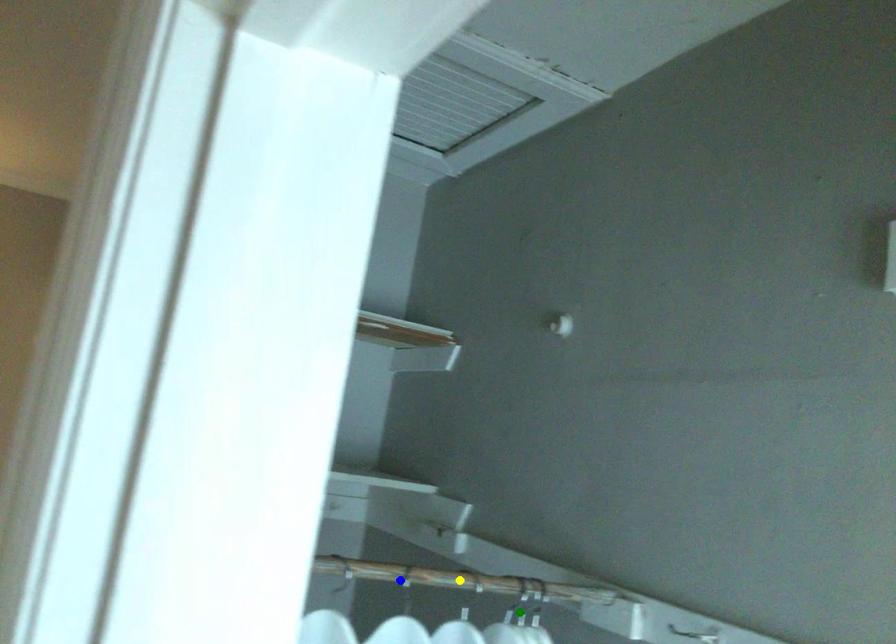
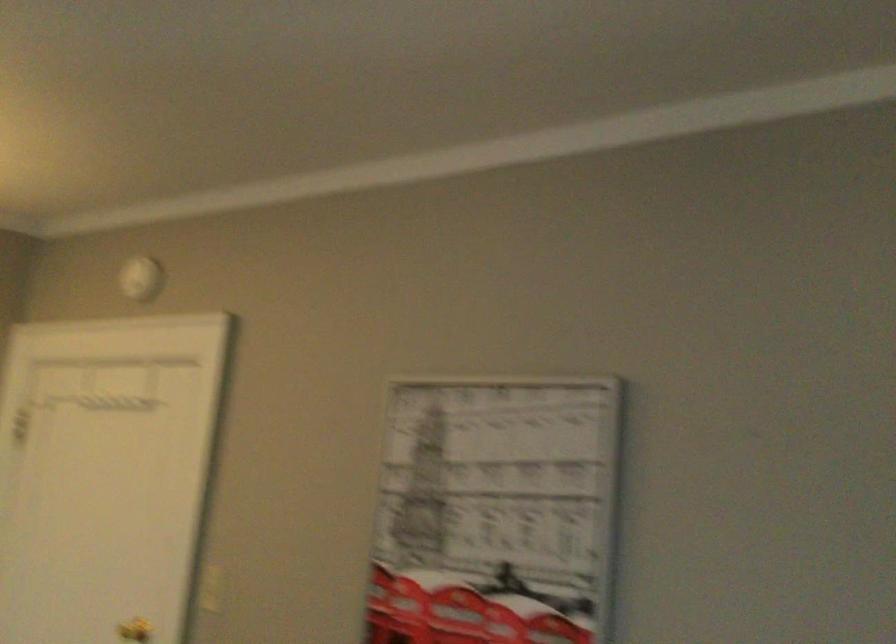
I am providing you with two images of the same scene from different viewpoints. Three points are marked in image1. Which point corresponds to a part or object that is occluded in image2?In image1, three points are marked. Which of them correspond to a part or object that is occluded in image2?Among the three points shown in image1, which one corresponds to a part or object that is no longer visible due to occlusion in image2?

Invisible in image2: blue point, green point, yellow point.